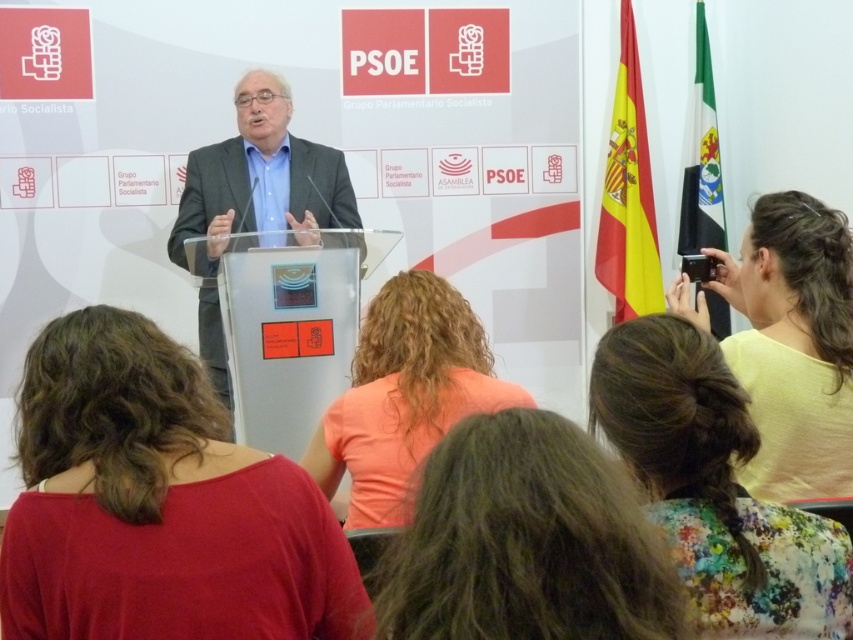
Question: Which of the following is the farthest from the observer?

Choices:
 (A) (x=276, y=541)
 (B) (x=265, y=189)

Answer: (B)

Question: Is floral fabric dress at lower right to the right of dark gray suit at center from the viewer's perspective?

Choices:
 (A) no
 (B) yes

Answer: (B)

Question: Is the position of light yellow fabric at right less distant than that of orange fabric shirt at center?

Choices:
 (A) yes
 (B) no

Answer: (B)

Question: From the image, what is the correct spatial relationship of dark gray suit at center in relation to green fabric flag at right?

Choices:
 (A) below
 (B) above

Answer: (A)

Question: Estimate the real-world distances between objects in this image. Which object is closer to the green fabric flag at right?

Choices:
 (A) yellow/red striped fabric at upper right
 (B) dark gray suit at center

Answer: (A)

Question: Which of the following is the farthest from the observer?

Choices:
 (A) (276, 561)
 (B) (724, 284)

Answer: (B)